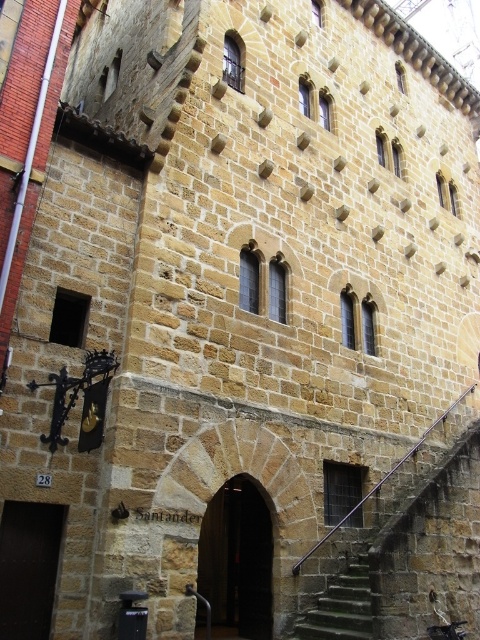
Is green mossy stone stairs at lower right wider than green mossy stone stairs at lower center?

Yes, green mossy stone stairs at lower right is wider than green mossy stone stairs at lower center.

Does green mossy stone stairs at lower right appear on the right side of green mossy stone stairs at lower center?

Correct, you'll find green mossy stone stairs at lower right to the right of green mossy stone stairs at lower center.

At what (x,y) coordinates should I click in order to perform the action: click on green mossy stone stairs at lower right. Please return your answer as a coordinate pair (x, y). This screenshot has width=480, height=640. Looking at the image, I should click on (412, 561).

Find the location of `green mossy stone stairs at lower right`. green mossy stone stairs at lower right is located at coordinates [412, 561].

Is dark brown stone archway at center positioned before green mossy stone stairs at lower center?

That is True.

The image size is (480, 640). I want to click on dark brown stone archway at center, so click(x=237, y=561).

Does green mossy stone stairs at lower right come in front of dark brown wooden door at lower left?

No, green mossy stone stairs at lower right is behind dark brown wooden door at lower left.

Does green mossy stone stairs at lower right come behind dark brown wooden door at lower left?

Yes, it is behind dark brown wooden door at lower left.

Is point (456, 460) farther from camera compared to point (35, 508)?

That is True.

Where is `green mossy stone stairs at lower right`? The height and width of the screenshot is (640, 480). green mossy stone stairs at lower right is located at coordinates (412, 561).